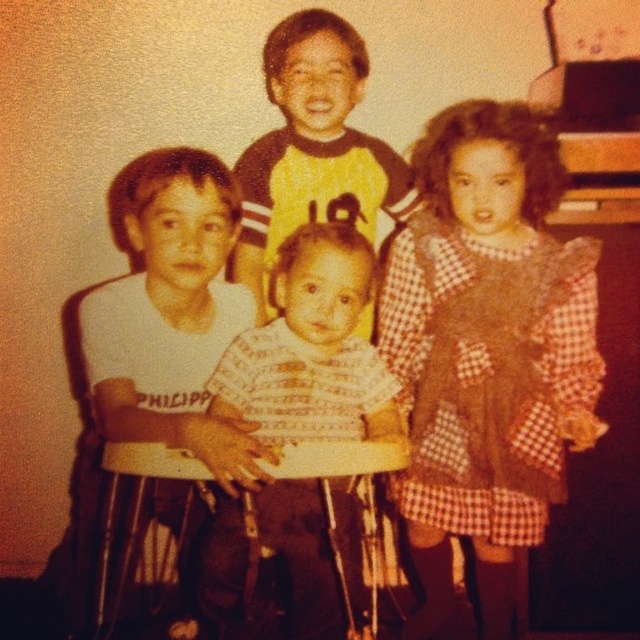
Question: Among these points, which one is nearest to the camera?

Choices:
 (A) (333, 314)
 (B) (470, 454)
 (C) (358, 65)
 (D) (195, 202)

Answer: (D)

Question: Is white cotton shirt at left in front of white striped shirt at center?

Choices:
 (A) yes
 (B) no

Answer: (A)

Question: Can you confirm if brown checkered dress at center is positioned to the right of white cotton shirt at left?

Choices:
 (A) no
 (B) yes

Answer: (B)

Question: Which point is farther to the camera?

Choices:
 (A) (468, 214)
 (B) (269, 54)
 (C) (330, 611)
 (D) (115, 316)

Answer: (B)

Question: In this image, where is brown checkered dress at center located relative to white cotton shirt at left?

Choices:
 (A) right
 (B) left

Answer: (A)

Question: Which point is closer to the camera taking this photo?

Choices:
 (A) (244, 442)
 (B) (515, 204)
 (C) (360, 224)

Answer: (A)